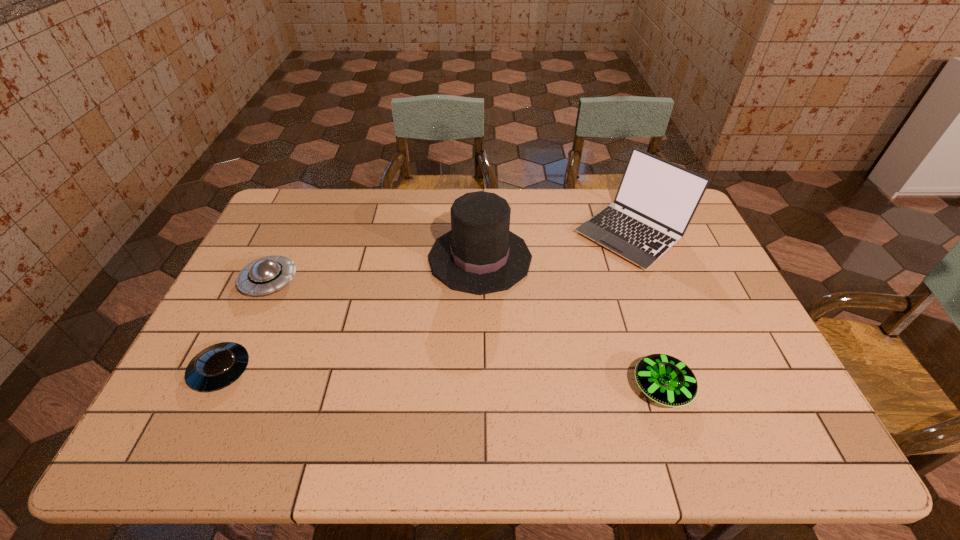
Locate which object ranks fourth in proximity to the dress hat. Please provide its 2D coordinates. Your answer should be formatted as a tuple, i.e. [(x, y)], where the tuple contains the x and y coordinates of a point satisfying the conditions above.

[(217, 366)]

Point out which object is positioned as the fourth nearest to the laptop_computer. Please provide its 2D coordinates. Your answer should be formatted as a tuple, i.e. [(x, y)], where the tuple contains the x and y coordinates of a point satisfying the conditions above.

[(217, 366)]

Image resolution: width=960 pixels, height=540 pixels. I want to click on the second closest saucer relative to the shortest object, so click(x=665, y=379).

What are the coordinates of `saucer that stands as the closest to the rightmost saucer` in the screenshot? It's located at (265, 275).

This screenshot has height=540, width=960. I want to click on free space that satisfies the following two spatial constraints: 1. at the front screen of the laptop_computer; 2. on the front side of the shortest saucer, so pyautogui.click(x=684, y=370).

In order to click on vacant space that satisfies the following two spatial constraints: 1. on the front of the rightmost saucer with the decoration; 2. on the right side of the dress hat in this screenshot , I will do `click(480, 387)`.

In order to click on vacant space that satisfies the following two spatial constraints: 1. on the front of the dress hat with the decoration; 2. on the front side of the shortest saucer in this screenshot , I will do `click(480, 370)`.

Find the location of a particular element. free spot that satisfies the following two spatial constraints: 1. on the front of the rightmost saucer with the decoration; 2. on the right side of the dress hat is located at coordinates (480, 387).

Where is `blank space that satisfies the following two spatial constraints: 1. on the front of the dress hat with the decoration; 2. on the left side of the rightmost saucer`? The height and width of the screenshot is (540, 960). blank space that satisfies the following two spatial constraints: 1. on the front of the dress hat with the decoration; 2. on the left side of the rightmost saucer is located at coordinates (480, 387).

The width and height of the screenshot is (960, 540). I want to click on free point that satisfies the following two spatial constraints: 1. on the front of the rightmost saucer with the decoration; 2. on the right side of the third object from right to left, so click(x=480, y=387).